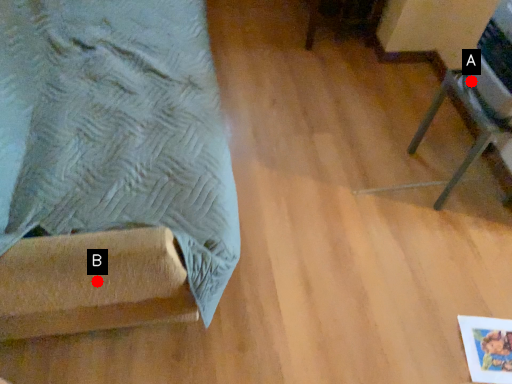
Question: Two points are circled on the image, labeled by A and B beside each circle. Which point appears closest to the camera in this image?

Choices:
 (A) A is closer
 (B) B is closer

Answer: (B)